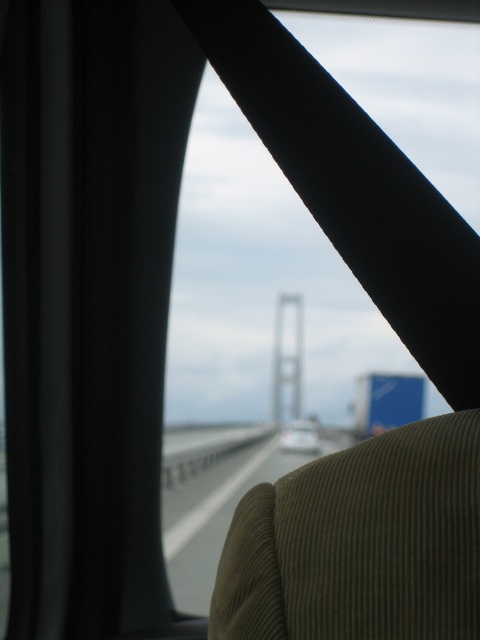
Question: Is white asphalt highway at center positioned behind white glossy car at center?

Choices:
 (A) yes
 (B) no

Answer: (B)

Question: Where is white asphalt highway at center located in relation to white glossy car at center in the image?

Choices:
 (A) right
 (B) left

Answer: (B)

Question: Which point appears closest to the camera in this image?

Choices:
 (A) (303, 420)
 (B) (268, 470)

Answer: (B)

Question: Which point appears closest to the camera in this image?

Choices:
 (A) (192, 483)
 (B) (282, 435)

Answer: (A)

Question: Does white asphalt highway at center appear on the right side of white glossy car at center?

Choices:
 (A) yes
 (B) no

Answer: (B)